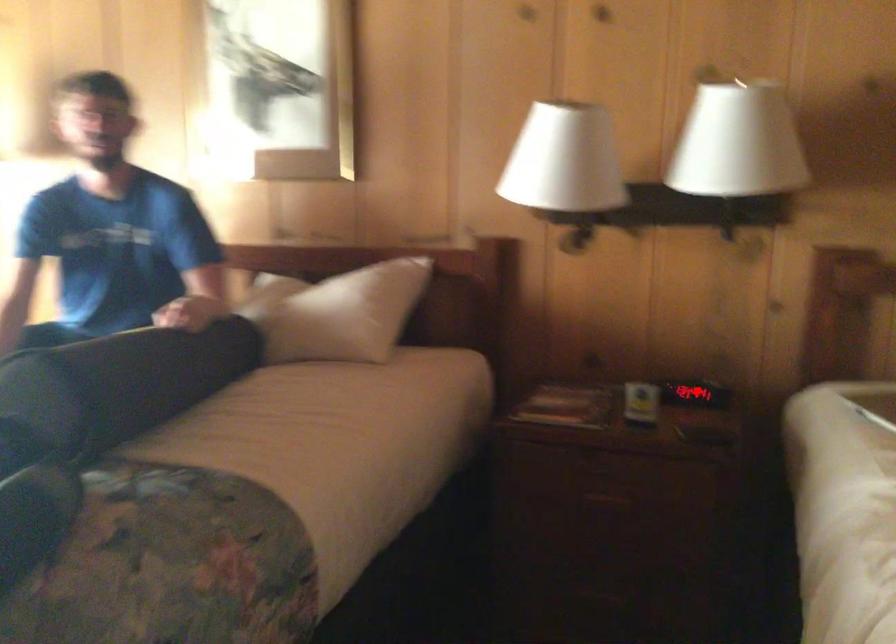
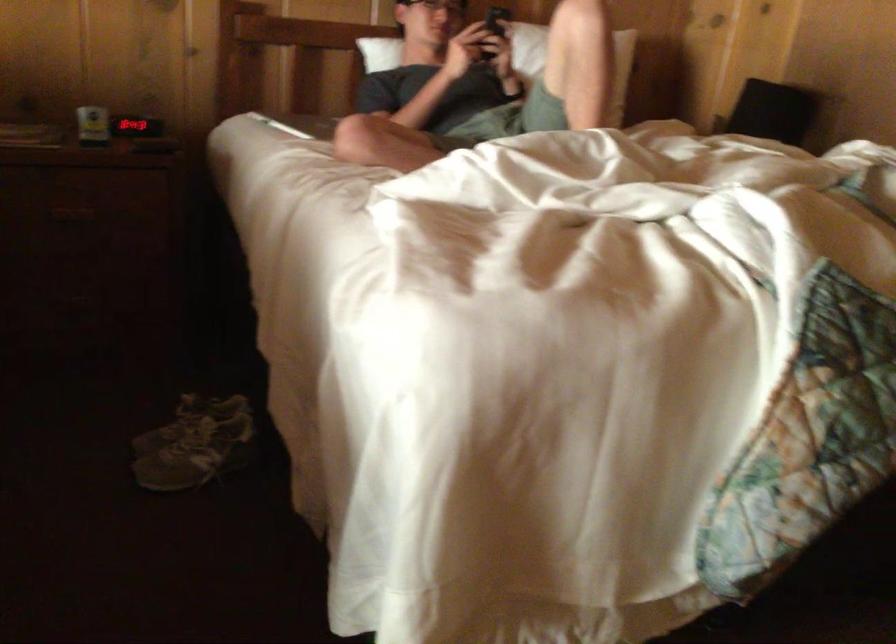
Question: I am providing you with two images of the same scene from different viewpoints. A red point is shown in image1. For the corresponding object point in image2, is it positioned nearer or farther from the camera?

Choices:
 (A) Nearer
 (B) Farther

Answer: (B)